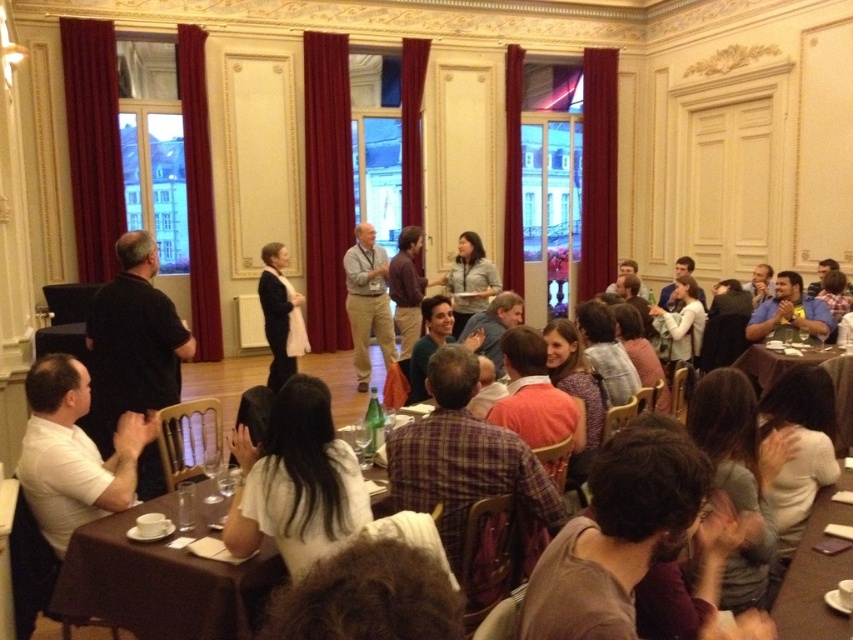
Question: In this image, where is brown fabric table at lower center located relative to light gray shirt at center?

Choices:
 (A) left
 (B) right

Answer: (A)

Question: Which point is closer to the camera taking this photo?

Choices:
 (A) (169, 572)
 (B) (288, 342)
 (C) (757, 362)

Answer: (A)

Question: Can you confirm if wooden table at lower right is smaller than light gray shirt at center?

Choices:
 (A) no
 (B) yes

Answer: (B)

Question: Which of these objects is positioned closest to the brown fabric table at lower center?

Choices:
 (A) matte black coat at center
 (B) brown wooden table at lower right

Answer: (A)

Question: Which object is closer to the camera taking this photo?

Choices:
 (A) brown wooden table at lower right
 (B) light gray shirt at center
 (C) wooden table at lower right
 (D) brown fabric table at lower center

Answer: (C)

Question: Does wooden table at lower right lie behind light gray shirt at center?

Choices:
 (A) yes
 (B) no

Answer: (B)